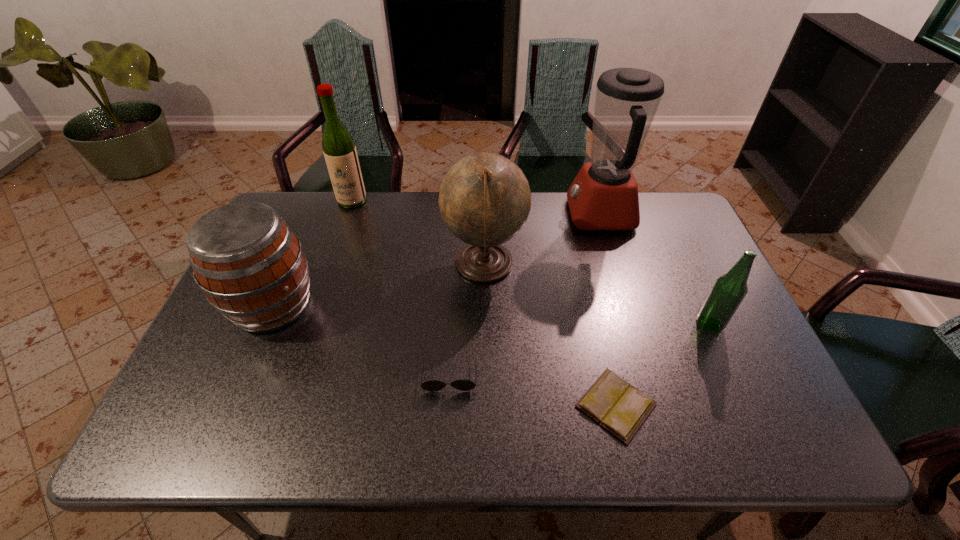
The height and width of the screenshot is (540, 960). I want to click on blender that is at the far edge, so click(604, 195).

What are the coordinates of `liquor that is positioned at the far edge` in the screenshot? It's located at (339, 149).

I want to click on globe that is at the far edge, so click(x=484, y=199).

This screenshot has height=540, width=960. Identify the location of object that is at the near edge. (620, 408).

I want to click on object that is positioned at the left edge, so click(251, 267).

You are a GUI agent. You are given a task and a screenshot of the screen. Output one action in this format:
    pyautogui.click(x=<x>, y=<y>)
    Task: Click on the object located at the right edge
    
    Given the screenshot: What is the action you would take?
    pyautogui.click(x=729, y=290)

In order to click on vacant area at the far edge of the desktop in this screenshot , I will do `click(419, 205)`.

Find the location of a particular element. This screenshot has width=960, height=540. free region at the near edge is located at coordinates (544, 433).

You are a GUI agent. You are given a task and a screenshot of the screen. Output one action in this format:
    pyautogui.click(x=<x>, y=<y>)
    Task: Click on the blank space at the left edge of the desktop
    
    Given the screenshot: What is the action you would take?
    pyautogui.click(x=250, y=392)

Where is `vacant space at the right edge of the desktop`? vacant space at the right edge of the desktop is located at coordinates (697, 343).